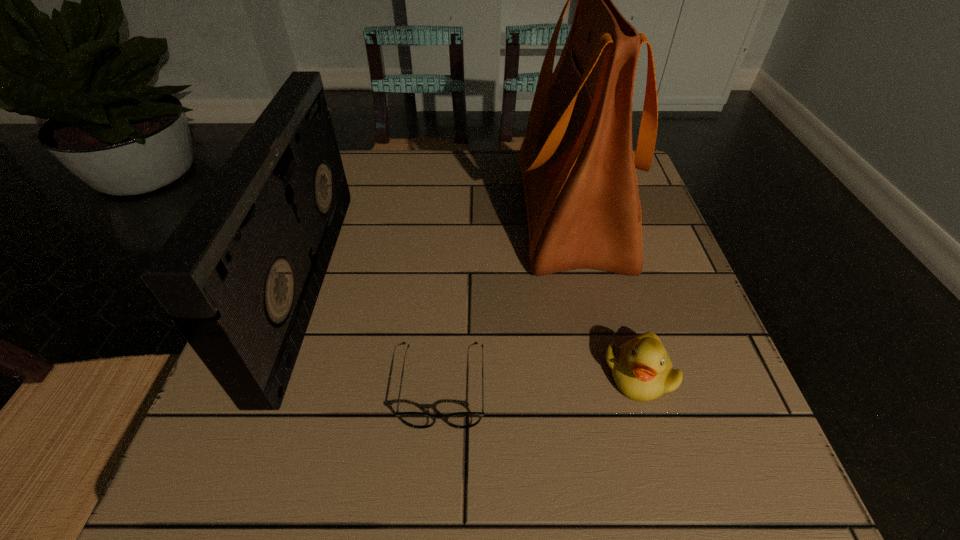
Where is `the tallest object`? the tallest object is located at coordinates tap(577, 164).

Image resolution: width=960 pixels, height=540 pixels. I want to click on the leftmost object, so click(x=241, y=274).

The height and width of the screenshot is (540, 960). I want to click on the third shortest object, so click(x=241, y=274).

At what (x,y) coordinates should I click in order to perform the action: click on the third tallest object. Please return your answer as a coordinate pair (x, y). Looking at the image, I should click on (641, 368).

Image resolution: width=960 pixels, height=540 pixels. I want to click on spectacles, so click(x=420, y=420).

Identify the location of the shortest object. The width and height of the screenshot is (960, 540). (420, 420).

Locate an element on the screen. This screenshot has width=960, height=540. vacant space located on the front pocket of the tallest object is located at coordinates (446, 211).

Find the location of `blank space located 0.210m on the front pocket of the tallest object`. blank space located 0.210m on the front pocket of the tallest object is located at coordinates (425, 211).

Locate an element on the screen. The height and width of the screenshot is (540, 960). vacant position located on the front pocket of the tallest object is located at coordinates (481, 211).

In order to click on vacant region located on the front side of the videotape in this screenshot , I will do `click(410, 282)`.